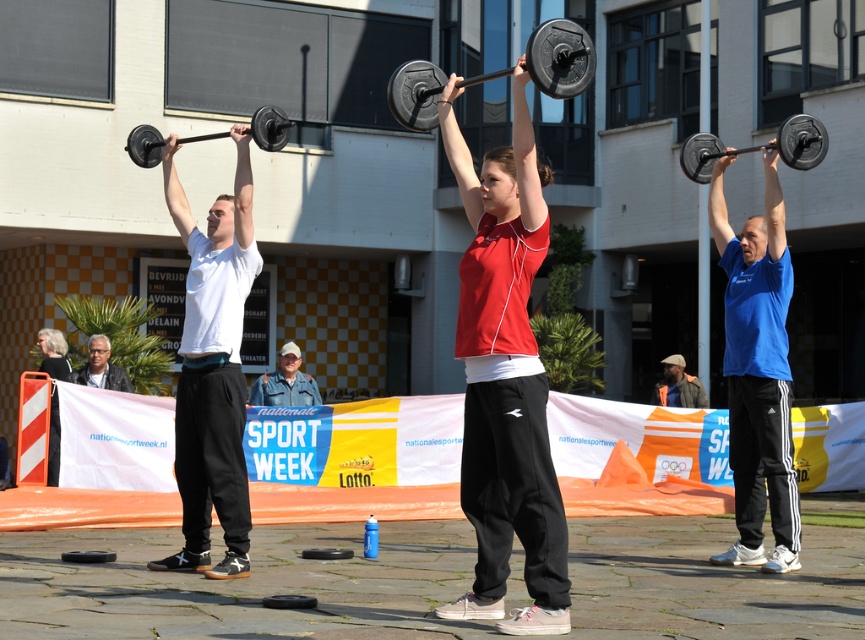
Question: Where is blue matte shirt at center located in relation to black textured barbell at upper right in the image?

Choices:
 (A) left
 (B) right

Answer: (A)

Question: Which of the following is the closest to the observer?

Choices:
 (A) (767, 230)
 (B) (492, 156)
 (C) (552, 84)
 (D) (527, 349)

Answer: (C)

Question: Which point is farther to the camera?

Choices:
 (A) blue fabric head at center
 (B) black metallic barbell at center
 (C) matte white shirt at center
 (D) matte red shirt at center

Answer: (A)

Question: Is black rubber barbell at center to the right of black metallic barbell at center from the viewer's perspective?

Choices:
 (A) no
 (B) yes

Answer: (B)

Question: Which point is farther to the camera?

Choices:
 (A) (42, 333)
 (B) (490, 188)
 (C) (159, 147)

Answer: (A)

Question: Observing the image, what is the correct spatial positioning of black metallic barbell at center in reference to khaki fabric cap at center?

Choices:
 (A) left
 (B) right

Answer: (B)